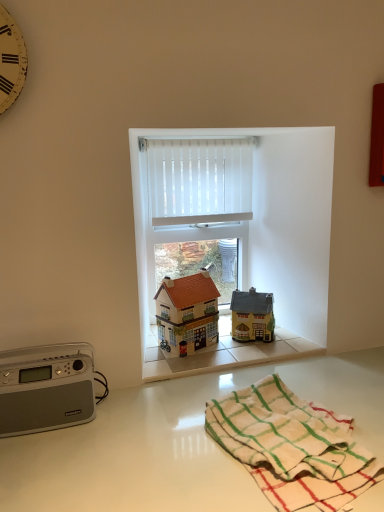
Identify the location of vacant point to the left of matte yellow house at center, the 1th toy when ordered from right to left. (216, 344).